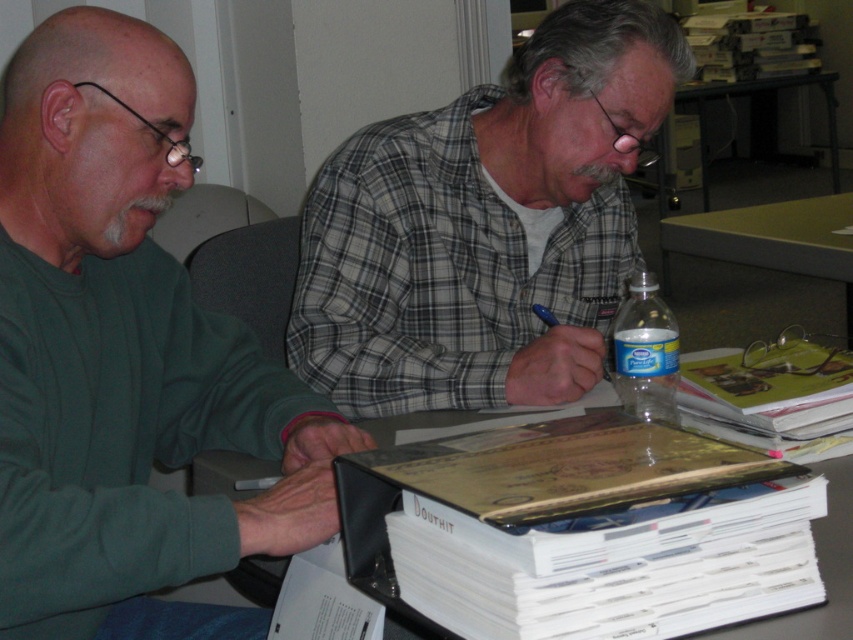
You are organizing a meeting and need to place a 12 inch wide laptop between the green matte sweater at left and the green laminate table at center. Can you fit it there?

The green matte sweater at left is positioned on the left side of green laminate table at center, so there is space between them. However, the distance between them is not specified, so it is uncertain if the 12 inch laptop will fit.

You are standing in front of the desk. Where is the green matte sweater at left located in terms of coordinates?

The green matte sweater at left is located at coordinates point (126, 358).